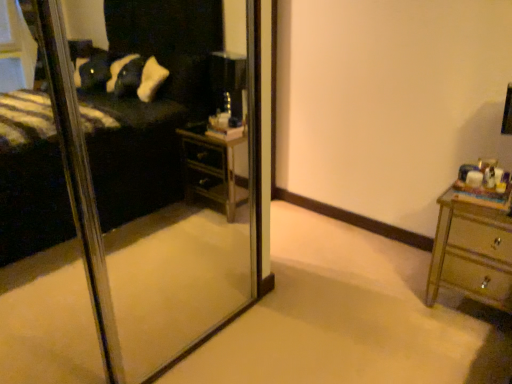
This screenshot has width=512, height=384. In order to click on vacant space situated on the left part of wooden chest of drawers at right in this screenshot , I will do `click(393, 299)`.